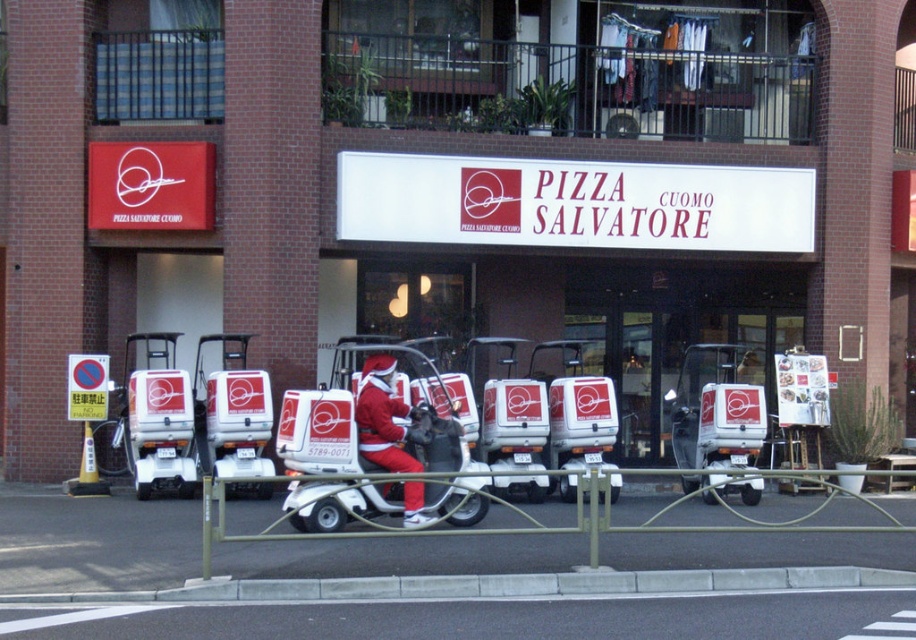
You are a delivery person who needs to load a large pizza box onto a vehicle. You see a white matte golf cart at center and a santa claus costume at center. Which vehicle can accommodate the large pizza box based on their widths?

The white matte golf cart at center has a larger width than the santa claus costume at center, so the large pizza box can be accommodated on the white matte golf cart at center.

You are a delivery driver who needs to load a large pizza box onto the vehicle. The box measures 1.2 meters in length. Which vehicle, the white matte golf cart at center or the santa claus costume at center, can accommodate the pizza box based on their sizes?

The white matte golf cart at center has a larger size compared to the santa claus costume at center, so the pizza box can be accommodated on the white matte golf cart at center.

Based on the photo, you are a customer standing in front of the Pizza Salvatore Cuomo restaurant. You see a white matte golf cart at center and a santa claus costume at center. Which object is positioned to the right?

The white matte golf cart at center is positioned to the right of the santa claus costume at center.